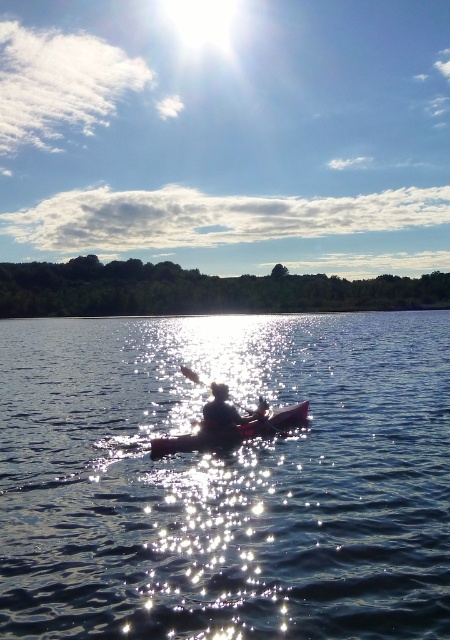
Is glistening water at center to the right of wooden paddle at center from the viewer's perspective?

Yes, glistening water at center is to the right of wooden paddle at center.

Image resolution: width=450 pixels, height=640 pixels. Describe the element at coordinates (225, 480) in the screenshot. I see `glistening water at center` at that location.

At what (x,y) coordinates should I click in order to perform the action: click on glistening water at center. Please return your answer as a coordinate pair (x, y). The height and width of the screenshot is (640, 450). Looking at the image, I should click on (225, 480).

What are the coordinates of `glistening water at center` in the screenshot? It's located at (225, 480).

I want to click on glistening water at center, so click(x=225, y=480).

I want to click on glistening water at center, so click(x=225, y=480).

Is point (214, 410) closer to camera compared to point (226, 412)?

That is True.

Is point (194, 380) positioned after point (208, 406)?

Yes, point (194, 380) is behind point (208, 406).

This screenshot has height=640, width=450. I want to click on wooden paddle at center, so click(x=229, y=412).